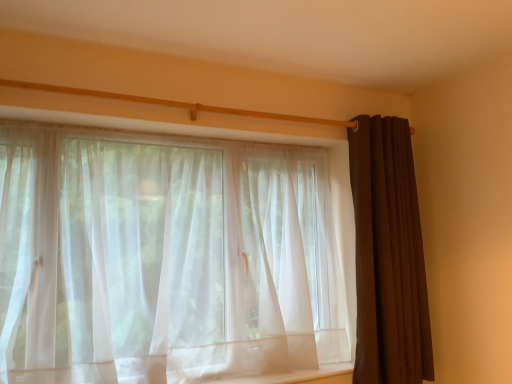
This screenshot has width=512, height=384. Describe the element at coordinates (166, 255) in the screenshot. I see `sheer white curtain at center, the 2th curtain positioned from the right` at that location.

Measure the distance between sheer white curtain at center, the 2th curtain positioned from the right, and camera.

sheer white curtain at center, the 2th curtain positioned from the right, is 1.66 meters away from camera.

Where is `sheer white curtain at center, the 2th curtain positioned from the right`? This screenshot has width=512, height=384. sheer white curtain at center, the 2th curtain positioned from the right is located at coordinates (166, 255).

Describe the element at coordinates (388, 256) in the screenshot. The image size is (512, 384). I see `brown textured curtain at right, which ranks as the 1th curtain in right-to-left order` at that location.

The width and height of the screenshot is (512, 384). What are the coordinates of `brown textured curtain at right, which ranks as the 1th curtain in right-to-left order` in the screenshot? It's located at (388, 256).

Locate an element on the screen. sheer white curtain at center, the 2th curtain positioned from the right is located at coordinates (166, 255).

Considering the positions of objects sheer white curtain at center, the first curtain in the left-to-right sequence, and brown textured curtain at right, marked as the 2th curtain in a left-to-right arrangement, in the image provided, who is more to the right, sheer white curtain at center, the first curtain in the left-to-right sequence, or brown textured curtain at right, marked as the 2th curtain in a left-to-right arrangement,?

brown textured curtain at right, marked as the 2th curtain in a left-to-right arrangement, is more to the right.

Is the position of sheer white curtain at center, the 2th curtain positioned from the right, less distant than that of brown textured curtain at right, which ranks as the 1th curtain in right-to-left order?

Yes, it is in front of brown textured curtain at right, which ranks as the 1th curtain in right-to-left order.

Between point (277, 236) and point (374, 276), which one is positioned in front?

The point (374, 276) is in front.

From the image's perspective, is sheer white curtain at center, the first curtain in the left-to-right sequence, positioned above or below brown textured curtain at right, which ranks as the 1th curtain in right-to-left order?

sheer white curtain at center, the first curtain in the left-to-right sequence, is below brown textured curtain at right, which ranks as the 1th curtain in right-to-left order.

From a real-world perspective, is sheer white curtain at center, the 2th curtain positioned from the right, below brown textured curtain at right, marked as the 2th curtain in a left-to-right arrangement?

Yes, from a real-world perspective, sheer white curtain at center, the 2th curtain positioned from the right, is under brown textured curtain at right, marked as the 2th curtain in a left-to-right arrangement.

Which of these two, sheer white curtain at center, the first curtain in the left-to-right sequence, or brown textured curtain at right, marked as the 2th curtain in a left-to-right arrangement, is wider?

With larger width is sheer white curtain at center, the first curtain in the left-to-right sequence.

In terms of height, does sheer white curtain at center, the 2th curtain positioned from the right, look taller or shorter compared to brown textured curtain at right, which ranks as the 1th curtain in right-to-left order?

In the image, sheer white curtain at center, the 2th curtain positioned from the right, appears to be shorter than brown textured curtain at right, which ranks as the 1th curtain in right-to-left order.

In terms of size, does sheer white curtain at center, the first curtain in the left-to-right sequence, appear bigger or smaller than brown textured curtain at right, which ranks as the 1th curtain in right-to-left order?

sheer white curtain at center, the first curtain in the left-to-right sequence, is bigger than brown textured curtain at right, which ranks as the 1th curtain in right-to-left order.

In the scene shown: Would you say brown textured curtain at right, marked as the 2th curtain in a left-to-right arrangement, is part of sheer white curtain at center, the 2th curtain positioned from the right,'s contents?

No.

Are sheer white curtain at center, the first curtain in the left-to-right sequence, and brown textured curtain at right, marked as the 2th curtain in a left-to-right arrangement, beside each other?

No, sheer white curtain at center, the first curtain in the left-to-right sequence, is not beside brown textured curtain at right, marked as the 2th curtain in a left-to-right arrangement.

Consider the image. Is sheer white curtain at center, the 2th curtain positioned from the right, oriented away from brown textured curtain at right, which ranks as the 1th curtain in right-to-left order?

sheer white curtain at center, the 2th curtain positioned from the right, does not have its back to brown textured curtain at right, which ranks as the 1th curtain in right-to-left order.

How different are the orientations of sheer white curtain at center, the first curtain in the left-to-right sequence, and brown textured curtain at right, which ranks as the 1th curtain in right-to-left order, in degrees?

0.358 degrees.

You are a GUI agent. You are given a task and a screenshot of the screen. Output one action in this format:
    pyautogui.click(x=<x>, y=<y>)
    Task: Click on the curtain to the left of brown textured curtain at right, which ranks as the 1th curtain in right-to-left order
    The image size is (512, 384).
    Given the screenshot: What is the action you would take?
    pyautogui.click(x=166, y=255)

Which is more to the left, brown textured curtain at right, which ranks as the 1th curtain in right-to-left order, or sheer white curtain at center, the first curtain in the left-to-right sequence?

sheer white curtain at center, the first curtain in the left-to-right sequence.

Is brown textured curtain at right, which ranks as the 1th curtain in right-to-left order, positioned behind sheer white curtain at center, the first curtain in the left-to-right sequence?

Yes, it is behind sheer white curtain at center, the first curtain in the left-to-right sequence.

Which point is more forward, [380,157] or [170,265]?

The point [170,265] is in front.

From the image's perspective, which object appears higher, brown textured curtain at right, which ranks as the 1th curtain in right-to-left order, or sheer white curtain at center, the first curtain in the left-to-right sequence?

From the image's view, brown textured curtain at right, which ranks as the 1th curtain in right-to-left order, is above.

From a real-world perspective, which object stands above the other?

brown textured curtain at right, marked as the 2th curtain in a left-to-right arrangement.

Considering the sizes of objects brown textured curtain at right, which ranks as the 1th curtain in right-to-left order, and sheer white curtain at center, the 2th curtain positioned from the right, in the image provided, who is thinner, brown textured curtain at right, which ranks as the 1th curtain in right-to-left order, or sheer white curtain at center, the 2th curtain positioned from the right,?

With smaller width is brown textured curtain at right, which ranks as the 1th curtain in right-to-left order.

From their relative heights in the image, would you say brown textured curtain at right, which ranks as the 1th curtain in right-to-left order, is taller or shorter than sheer white curtain at center, the first curtain in the left-to-right sequence?

brown textured curtain at right, which ranks as the 1th curtain in right-to-left order, is taller than sheer white curtain at center, the first curtain in the left-to-right sequence.

From the picture: Between brown textured curtain at right, which ranks as the 1th curtain in right-to-left order, and sheer white curtain at center, the first curtain in the left-to-right sequence, which one has smaller size?

brown textured curtain at right, which ranks as the 1th curtain in right-to-left order, is smaller.

Looking at this image, is brown textured curtain at right, marked as the 2th curtain in a left-to-right arrangement, not within sheer white curtain at center, the first curtain in the left-to-right sequence?

That's correct, brown textured curtain at right, marked as the 2th curtain in a left-to-right arrangement, is outside of sheer white curtain at center, the first curtain in the left-to-right sequence.

Is brown textured curtain at right, marked as the 2th curtain in a left-to-right arrangement, far away from sheer white curtain at center, the 2th curtain positioned from the right?

Actually, brown textured curtain at right, marked as the 2th curtain in a left-to-right arrangement, and sheer white curtain at center, the 2th curtain positioned from the right, are a little close together.

Could you tell me if brown textured curtain at right, marked as the 2th curtain in a left-to-right arrangement, is facing sheer white curtain at center, the first curtain in the left-to-right sequence?

No, brown textured curtain at right, marked as the 2th curtain in a left-to-right arrangement, is not turned towards sheer white curtain at center, the first curtain in the left-to-right sequence.

Find the location of a particular element. The height and width of the screenshot is (384, 512). curtain located above the sheer white curtain at center, the first curtain in the left-to-right sequence (from the image's perspective) is located at coordinates (388, 256).

Where is `curtain above the sheer white curtain at center, the 2th curtain positioned from the right (from a real-world perspective)`? This screenshot has height=384, width=512. curtain above the sheer white curtain at center, the 2th curtain positioned from the right (from a real-world perspective) is located at coordinates (388, 256).

Where is `curtain behind the sheer white curtain at center, the first curtain in the left-to-right sequence`? This screenshot has width=512, height=384. curtain behind the sheer white curtain at center, the first curtain in the left-to-right sequence is located at coordinates [x=388, y=256].